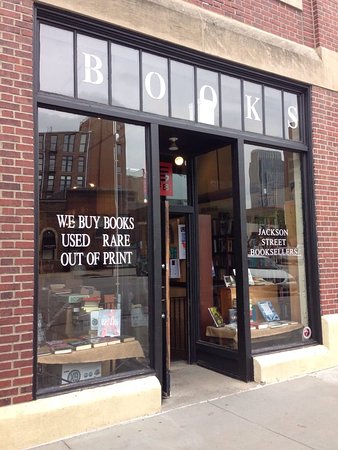
The height and width of the screenshot is (450, 338). Identify the location of table. (101, 354), (269, 331), (64, 301).